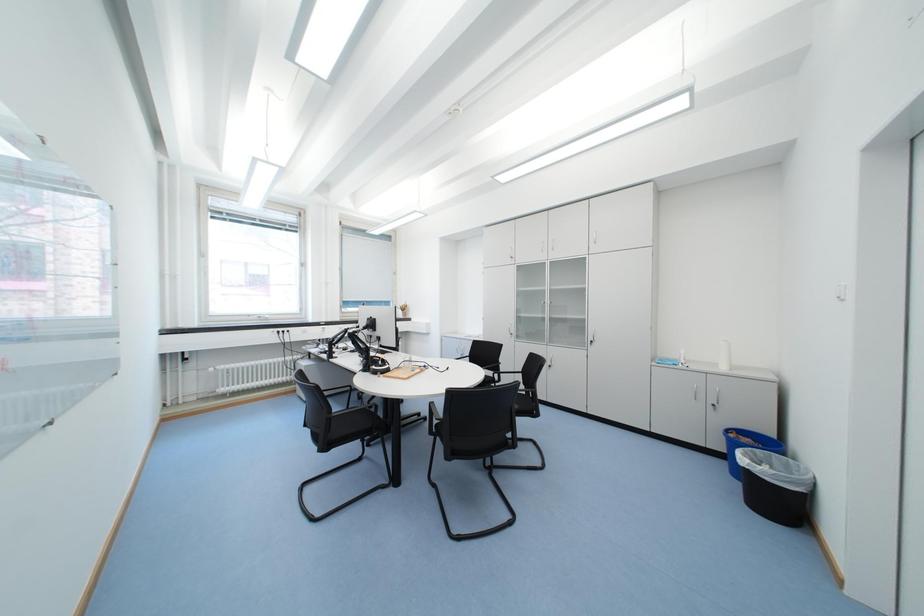
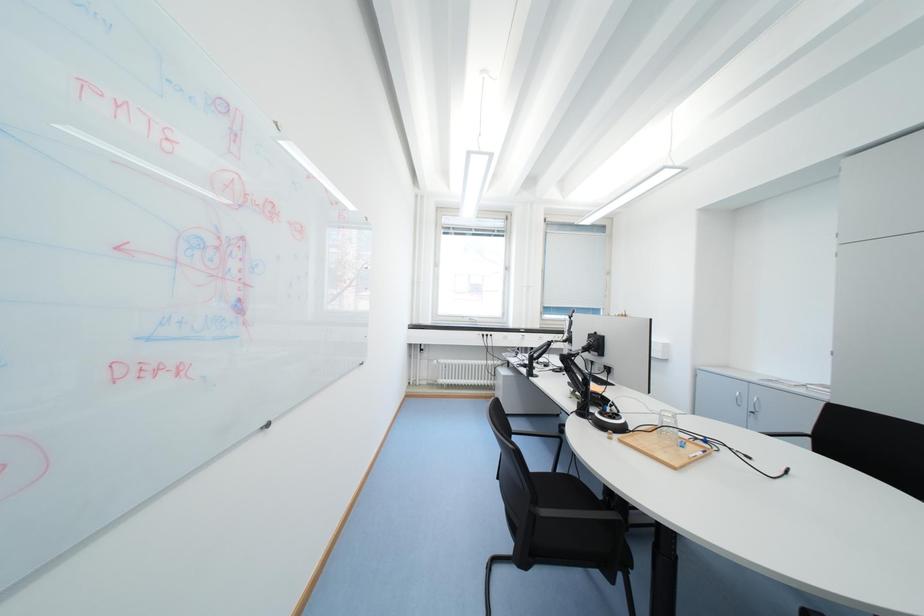
Question: Based on the continuous images, in which direction is the camera rotating? Reply with the corresponding letter.

Choices:
 (A) Left
 (B) Right
 (C) Up
 (D) Down

Answer: (A)